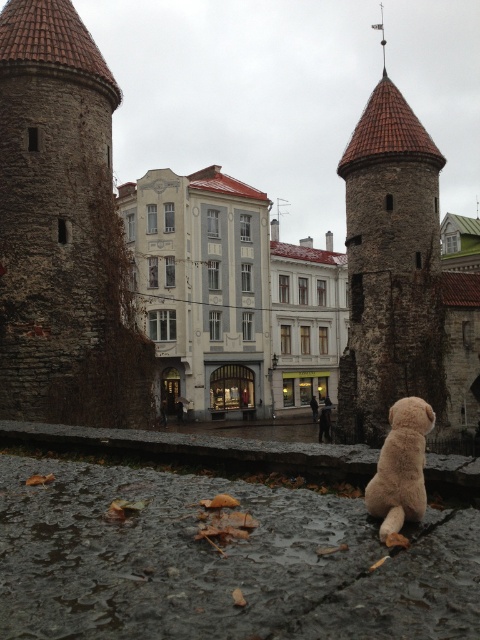
Question: Does rusty metal tower at center appear on the right side of fuzzy beige stuffed animal at lower right?

Choices:
 (A) yes
 (B) no

Answer: (A)

Question: Is rusty metal tower at center bigger than fuzzy beige stuffed animal at lower right?

Choices:
 (A) yes
 (B) no

Answer: (A)

Question: Which of the following is the closest to the observer?

Choices:
 (A) (417, 476)
 (B) (358, 312)

Answer: (A)

Question: Is rusty metal tower at center above fuzzy beige stuffed animal at lower right?

Choices:
 (A) yes
 (B) no

Answer: (A)